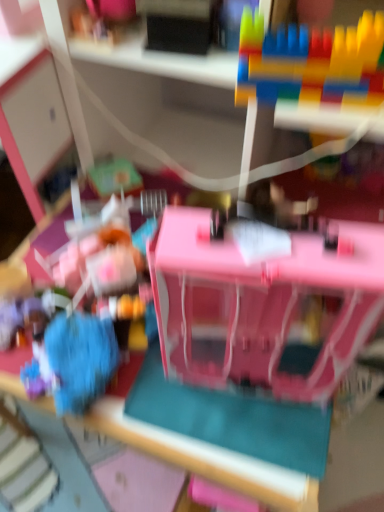
Question: Is the position of blue fuzzy ball at lower left, which is the first toy in bottom-to-top order, less distant than that of pink plastic dollhouse at center, the second toy in the bottom-to-top sequence?

Choices:
 (A) no
 (B) yes

Answer: (A)

Question: From a real-world perspective, is blue fuzzy ball at lower left, which is the 1th toy from left to right, on top of pink plastic dollhouse at center, arranged as the second toy when viewed from the left?

Choices:
 (A) yes
 (B) no

Answer: (B)

Question: Does blue fuzzy ball at lower left, the 3th toy when ordered from top to bottom, turn towards pink plastic dollhouse at center, the second toy viewed from the right?

Choices:
 (A) no
 (B) yes

Answer: (A)

Question: Does blue fuzzy ball at lower left, the 3th toy from the right, touch pink plastic dollhouse at center, the second toy viewed from the right?

Choices:
 (A) no
 (B) yes

Answer: (A)

Question: From the image's perspective, is blue fuzzy ball at lower left, the 3th toy from the right, located above pink plastic dollhouse at center, the second toy in the bottom-to-top sequence?

Choices:
 (A) no
 (B) yes

Answer: (A)

Question: Considering the relative positions of blue fuzzy ball at lower left, which is the first toy in bottom-to-top order, and pink plastic dollhouse at center, the 2th toy when ordered from top to bottom, in the image provided, is blue fuzzy ball at lower left, which is the first toy in bottom-to-top order, to the right of pink plastic dollhouse at center, the 2th toy when ordered from top to bottom, from the viewer's perspective?

Choices:
 (A) no
 (B) yes

Answer: (A)

Question: Is pink plastic dollhouse at center, the second toy viewed from the right, wider than multicolored plastic blocks at upper right, placed as the 1th toy when sorted from right to left?

Choices:
 (A) yes
 (B) no

Answer: (A)

Question: Is pink plastic dollhouse at center, arranged as the second toy when viewed from the left, shorter than multicolored plastic blocks at upper right, placed as the 1th toy when sorted from right to left?

Choices:
 (A) yes
 (B) no

Answer: (B)

Question: Is pink plastic dollhouse at center, the second toy in the bottom-to-top sequence, at the left side of multicolored plastic blocks at upper right, placed as the 1th toy when sorted from right to left?

Choices:
 (A) no
 (B) yes

Answer: (B)

Question: Could you tell me if pink plastic dollhouse at center, the 2th toy when ordered from top to bottom, is turned towards multicolored plastic blocks at upper right, acting as the 1th toy starting from the top?

Choices:
 (A) no
 (B) yes

Answer: (A)

Question: Can multicolored plastic blocks at upper right, placed as the 1th toy when sorted from right to left, be found inside pink plastic dollhouse at center, arranged as the second toy when viewed from the left?

Choices:
 (A) no
 (B) yes

Answer: (A)

Question: Is pink plastic dollhouse at center, the second toy in the bottom-to-top sequence, not close to multicolored plastic blocks at upper right, placed as the 1th toy when sorted from right to left?

Choices:
 (A) yes
 (B) no

Answer: (B)

Question: From a real-world perspective, does pink plastic dollhouse at center, arranged as the second toy when viewed from the left, sit lower than blue fuzzy ball at lower left, the 3th toy from the right?

Choices:
 (A) yes
 (B) no

Answer: (B)